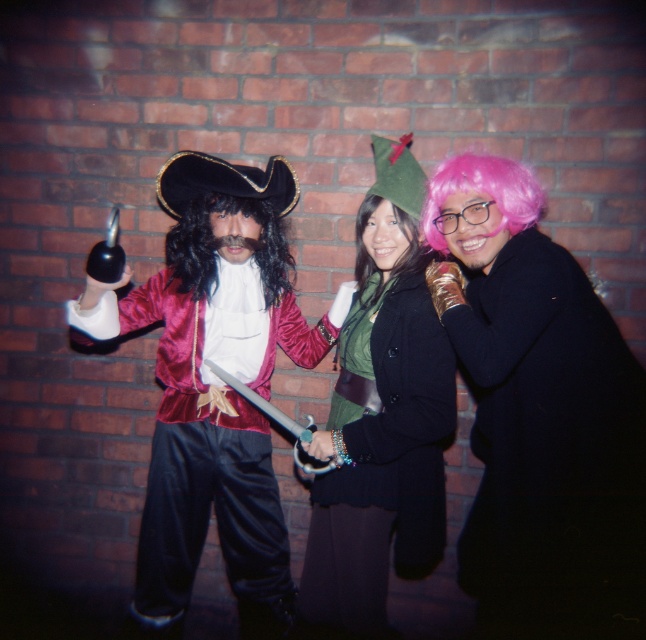
Is point (545, 337) positioned behind point (437, 228)?

No, (545, 337) is in front of (437, 228).

Is velvet pirate costume at center thinner than pink synthetic wig at center right?

In fact, velvet pirate costume at center might be wider than pink synthetic wig at center right.

This screenshot has height=640, width=646. What are the coordinates of `velvet pirate costume at center` in the screenshot? It's located at (486, 433).

Measure the distance between velvet green coat at center and black silky wig at center.

A distance of 17.06 inches exists between velvet green coat at center and black silky wig at center.

Is velvet green coat at center shorter than black silky wig at center?

No.

The height and width of the screenshot is (640, 646). Identify the location of velvet green coat at center. (380, 417).

Is velvet green coat at center further to camera compared to pink synthetic wig at center right?

Yes, velvet green coat at center is behind pink synthetic wig at center right.

Which is behind, point (424, 392) or point (474, 179)?

Positioned behind is point (424, 392).

Find the location of `velvet green coat at center`. velvet green coat at center is located at coordinates (380, 417).

Find the location of `velvet green coat at center`. velvet green coat at center is located at coordinates (380, 417).